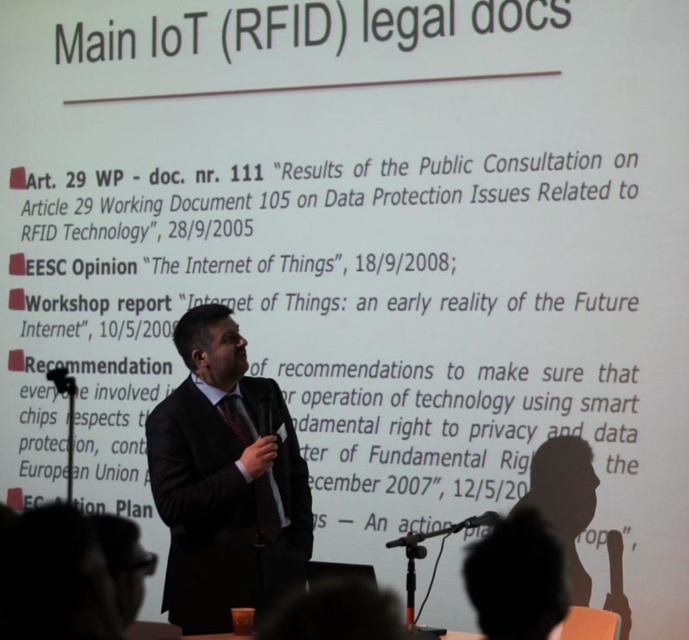
Does black suit at center have a smaller size compared to black plastic microphone at lower center?

Incorrect, black suit at center is not smaller in size than black plastic microphone at lower center.

Is point (280, 488) less distant than point (462, 529)?

That is True.

Identify the location of black suit at center. Image resolution: width=689 pixels, height=640 pixels. (225, 481).